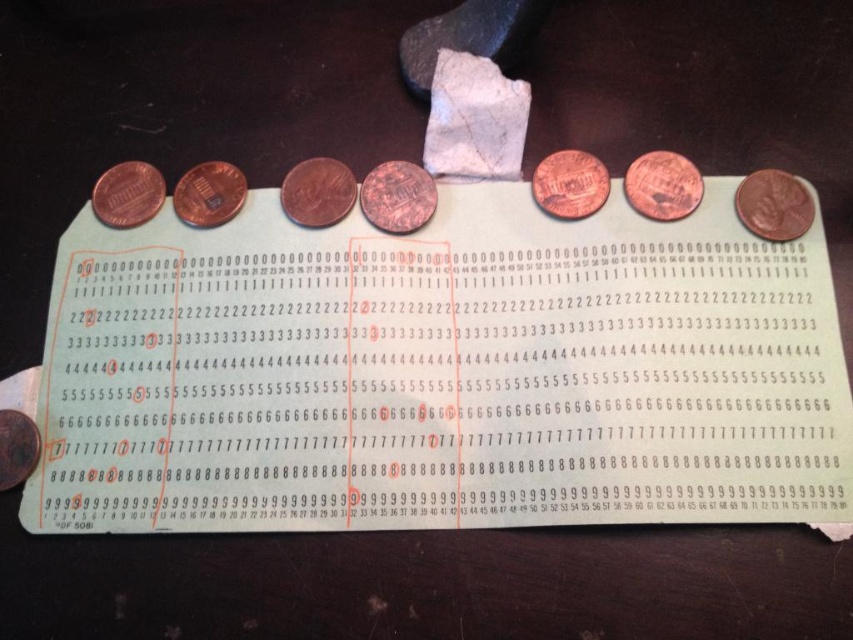
Question: Based on their relative distances, which object is farther from the copper shiny penny at center?

Choices:
 (A) copper/brass penny at left
 (B) copper/brass penny at upper right

Answer: (B)

Question: Considering the real-world distances, which object is closest to the brass/bronze penny at right?

Choices:
 (A) copper shiny penny at center
 (B) matte copper penny at center

Answer: (A)

Question: Can you confirm if brass-like copper penny at upper right is smaller than copper/brass penny at left?

Choices:
 (A) yes
 (B) no

Answer: (A)

Question: Is copper metallic penny at center positioned behind copper/brass penny at left?

Choices:
 (A) no
 (B) yes

Answer: (B)

Question: Is copper/brass penny at upper right positioned behind brass/bronze coin at lower left?

Choices:
 (A) yes
 (B) no

Answer: (A)

Question: Among these objects, which one is nearest to the camera?

Choices:
 (A) matte copper penny at center
 (B) copper/brass penny at left
 (C) brass-like copper penny at upper right

Answer: (B)